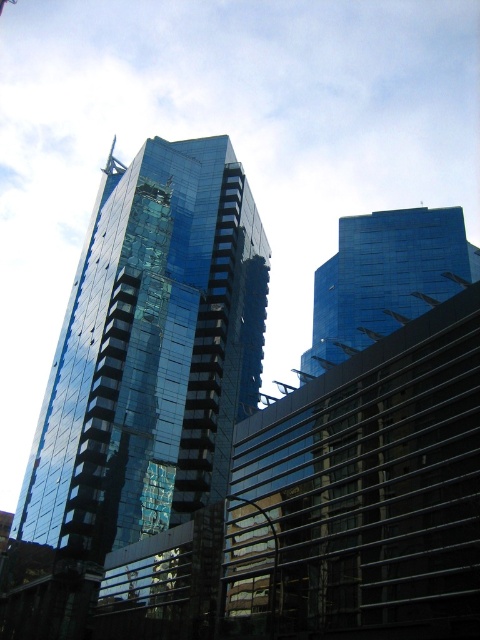
Question: Can you confirm if glossy glass building at center is positioned to the left of glossy glass building at upper center?

Choices:
 (A) no
 (B) yes

Answer: (B)

Question: Which of the following is the closest to the observer?

Choices:
 (A) (328, 285)
 (B) (192, 188)

Answer: (B)

Question: Does glossy glass building at center lie behind glossy glass building at upper center?

Choices:
 (A) no
 (B) yes

Answer: (B)

Question: Is glossy glass building at center wider than glossy glass building at upper center?

Choices:
 (A) no
 (B) yes

Answer: (B)